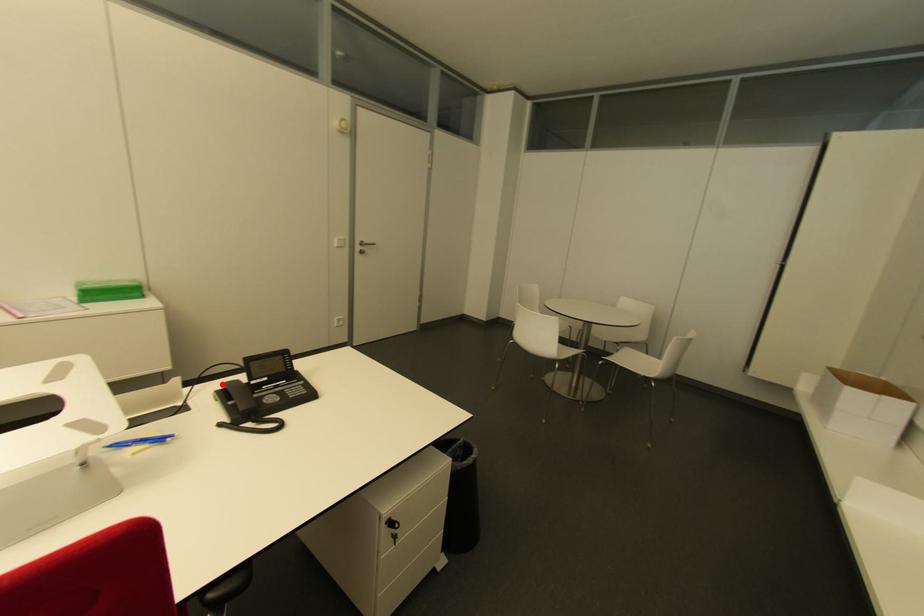
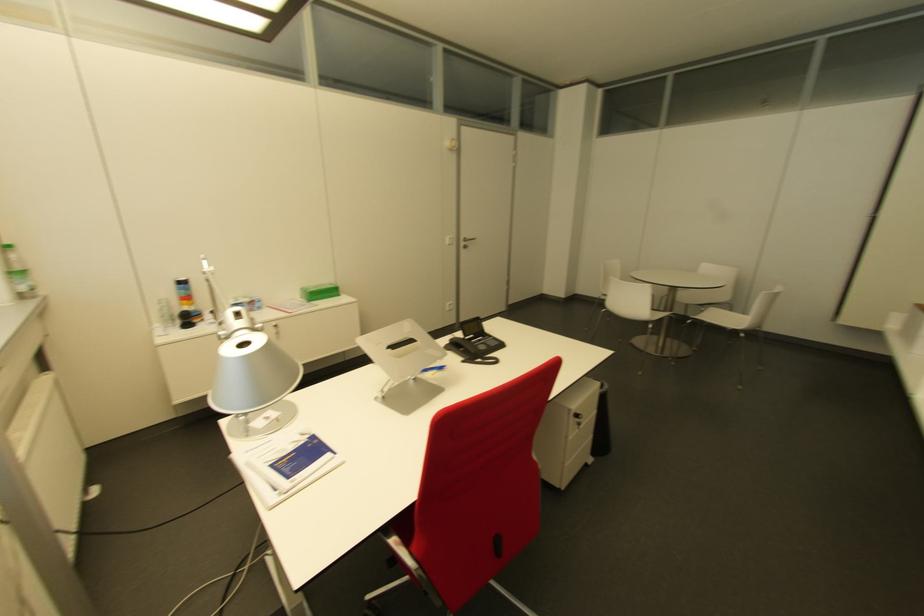
In the second image, find the point that corresponds to the highlighted location in the first image.

(447, 339)